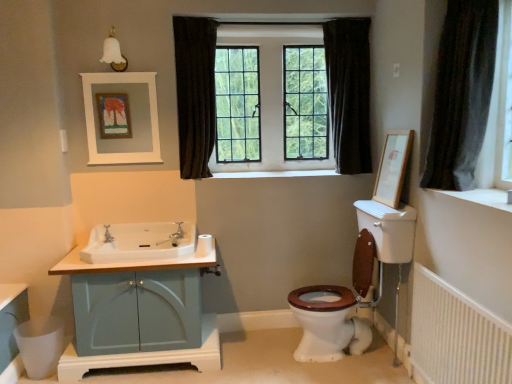
Question: From a real-world perspective, is dark fabric curtain at center, which appears as the third curtain when viewed from the front, beneath matte blue cabinet at left?

Choices:
 (A) yes
 (B) no

Answer: (B)

Question: From a real-world perspective, does dark fabric curtain at center, positioned as the 2th curtain in left-to-right order, stand above matte blue cabinet at left?

Choices:
 (A) yes
 (B) no

Answer: (A)

Question: Can you confirm if dark fabric curtain at center, positioned as the 2th curtain in left-to-right order, is shorter than matte blue cabinet at left?

Choices:
 (A) no
 (B) yes

Answer: (A)

Question: Considering the relative sizes of dark fabric curtain at center, positioned as the 2th curtain in left-to-right order, and matte blue cabinet at left in the image provided, is dark fabric curtain at center, positioned as the 2th curtain in left-to-right order, smaller than matte blue cabinet at left?

Choices:
 (A) yes
 (B) no

Answer: (A)

Question: Could matte blue cabinet at left be considered to be inside dark fabric curtain at center, positioned as the first curtain in back-to-front order?

Choices:
 (A) no
 (B) yes

Answer: (A)

Question: Does dark fabric curtain at center, positioned as the 2th curtain in left-to-right order, have a greater width compared to matte blue cabinet at left?

Choices:
 (A) no
 (B) yes

Answer: (A)

Question: Is brushed metal faucet at sink left, positioned as the first tap in left-to-right order, in front of white textured radiator at lower right?

Choices:
 (A) yes
 (B) no

Answer: (B)

Question: From the image's perspective, does brushed metal faucet at sink left, positioned as the first tap in left-to-right order, appear higher than white textured radiator at lower right?

Choices:
 (A) yes
 (B) no

Answer: (A)

Question: Can you confirm if brushed metal faucet at sink left, positioned as the first tap in left-to-right order, is shorter than white textured radiator at lower right?

Choices:
 (A) no
 (B) yes

Answer: (B)

Question: Is brushed metal faucet at sink left, which appears as the 2th tap when viewed from the right, to the right of white textured radiator at lower right from the viewer's perspective?

Choices:
 (A) no
 (B) yes

Answer: (A)

Question: Considering the relative sizes of brushed metal faucet at sink left, positioned as the first tap in left-to-right order, and white textured radiator at lower right in the image provided, is brushed metal faucet at sink left, positioned as the first tap in left-to-right order, bigger than white textured radiator at lower right?

Choices:
 (A) yes
 (B) no

Answer: (B)

Question: Does brushed metal faucet at sink left, positioned as the first tap in left-to-right order, have a smaller size compared to white textured radiator at lower right?

Choices:
 (A) no
 (B) yes

Answer: (B)

Question: Can you confirm if clear glass windows at center is wider than matte silver faucet at center, the first tap positioned from the right?

Choices:
 (A) yes
 (B) no

Answer: (B)